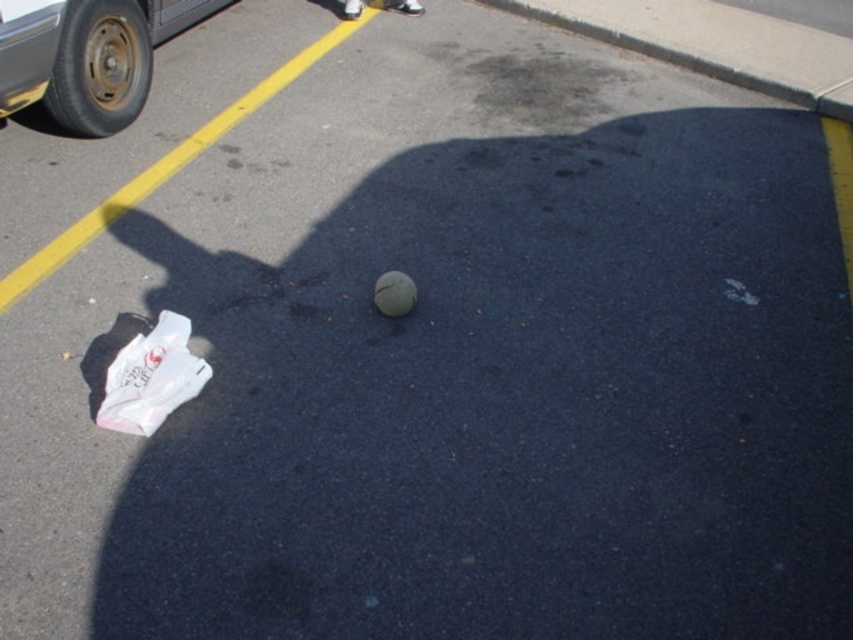
Is white plastic bag at lower left to the left of white matte ball at center from the viewer's perspective?

Indeed, white plastic bag at lower left is positioned on the left side of white matte ball at center.

Between point (189, 326) and point (402, 307), which one is positioned behind?

Point (402, 307)

Is point (126, 349) closer to camera compared to point (375, 289)?

Yes.

Locate an element on the screen. The image size is (853, 640). white plastic bag at lower left is located at coordinates (151, 378).